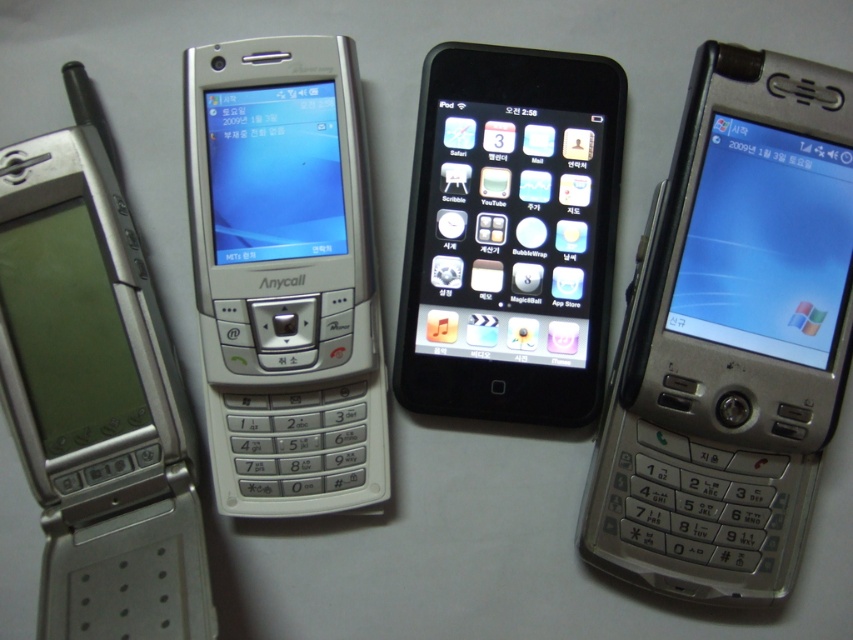
Question: Does silver metallic phone at right have a smaller size compared to black glossy ipod at center?

Choices:
 (A) yes
 (B) no

Answer: (B)

Question: Does silver metallic flip phone at left have a lesser width compared to black glossy ipod at center?

Choices:
 (A) no
 (B) yes

Answer: (B)

Question: Which point is closer to the camera?

Choices:
 (A) click(589, 157)
 (B) click(76, 509)
 (C) click(770, 70)
 (D) click(196, 172)

Answer: (C)

Question: Is silver metallic phone at center wider than black glossy ipod at center?

Choices:
 (A) yes
 (B) no

Answer: (B)

Question: Which object appears closest to the camera in this image?

Choices:
 (A) silver metallic flip phone at left
 (B) silver metallic phone at center

Answer: (A)

Question: Which object appears closest to the camera in this image?

Choices:
 (A) silver metallic phone at right
 (B) silver metallic flip phone at left

Answer: (B)